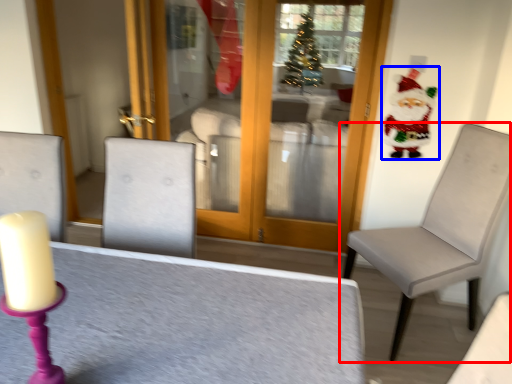
Question: Which point is closer to the camera, chair (highlighted by a red box) or santa claus (highlighted by a blue box)?

Choices:
 (A) chair
 (B) santa claus

Answer: (A)